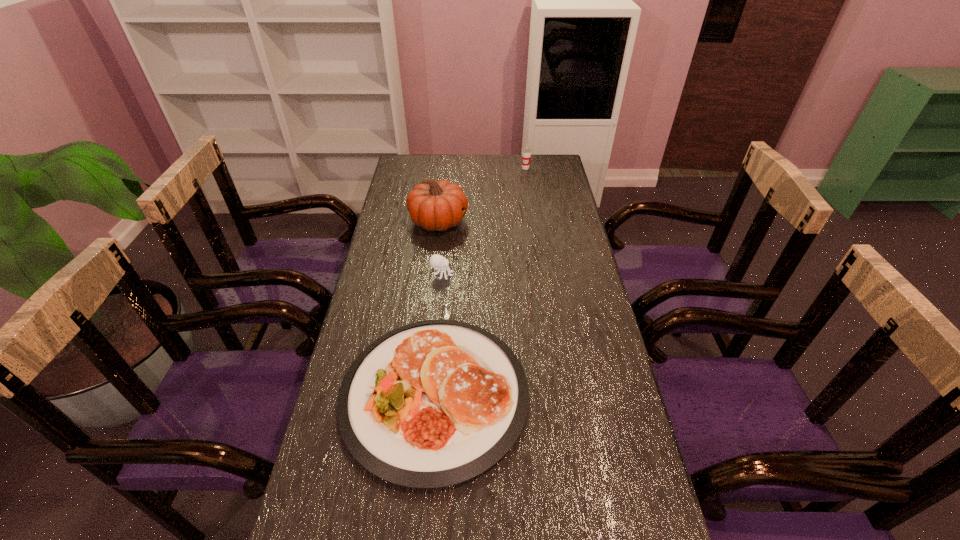
Identify the location of free region that satisfies the following two spatial constraints: 1. on the face of the nearest object; 2. on the left side of the tallest object. The width and height of the screenshot is (960, 540). (419, 395).

At what (x,y) coordinates should I click in order to perform the action: click on free space that satisfies the following two spatial constraints: 1. on the face of the second farthest object; 2. on the left side of the nearest object. Please return your answer as a coordinate pair (x, y). Image resolution: width=960 pixels, height=540 pixels. Looking at the image, I should click on (419, 395).